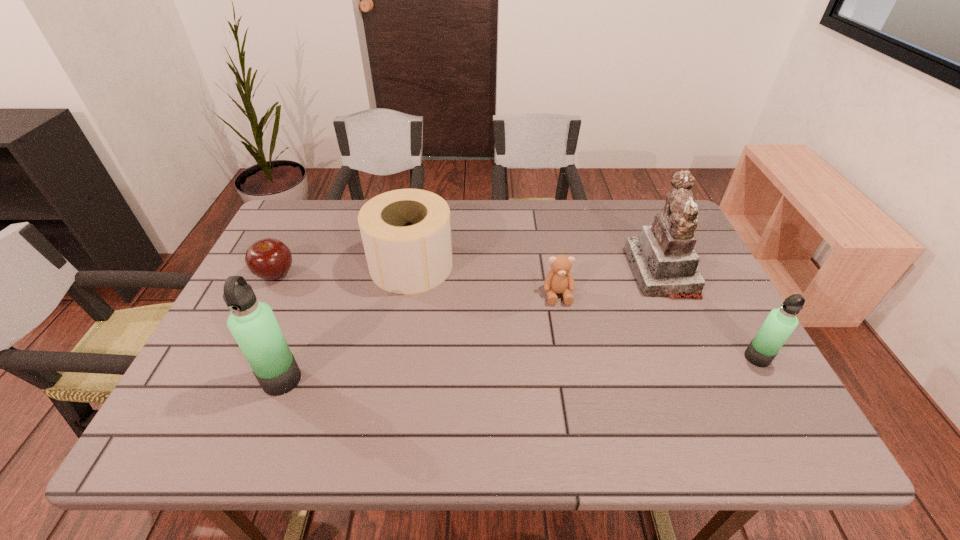
The height and width of the screenshot is (540, 960). What are the coordinates of `thermos bottle situated at the right edge` in the screenshot? It's located at (780, 323).

Locate an element on the screen. This screenshot has width=960, height=540. figurine that is at the right edge is located at coordinates (663, 259).

Find the location of a particular element. The width and height of the screenshot is (960, 540). object that is at the near left corner is located at coordinates (253, 324).

In the image, there is a desktop. Identify the location of vacant space at the far edge. (548, 214).

You are a GUI agent. You are given a task and a screenshot of the screen. Output one action in this format:
    pyautogui.click(x=<x>, y=<y>)
    Task: Click on the vacant space at the near edge
    This screenshot has width=960, height=540.
    Given the screenshot: What is the action you would take?
    pyautogui.click(x=516, y=394)

In the image, there is a desktop. Where is `vacant space at the right edge`? vacant space at the right edge is located at coordinates point(704,297).

Locate an element on the screen. The width and height of the screenshot is (960, 540). vacant area at the near left corner is located at coordinates (228, 395).

This screenshot has width=960, height=540. Find the location of `free space at the far right corner`. free space at the far right corner is located at coordinates (649, 225).

You are a GUI agent. You are given a task and a screenshot of the screen. Output one action in this format:
    pyautogui.click(x=<x>, y=<y>)
    Task: Click on the vacant space in between the taller thermos bottle and the teddy bear
    Image resolution: width=960 pixels, height=540 pixels.
    Given the screenshot: What is the action you would take?
    pyautogui.click(x=420, y=337)

Identify the location of unoccupied area between the teddy bear and the shorter thermos bottle. (658, 326).